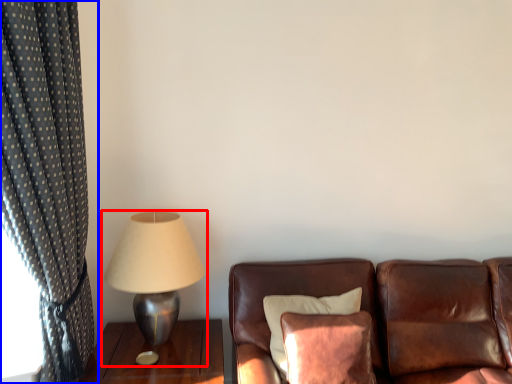
Question: Which object appears farthest to the camera in this image, lamp (highlighted by a red box) or curtain (highlighted by a blue box)?

Choices:
 (A) lamp
 (B) curtain

Answer: (A)